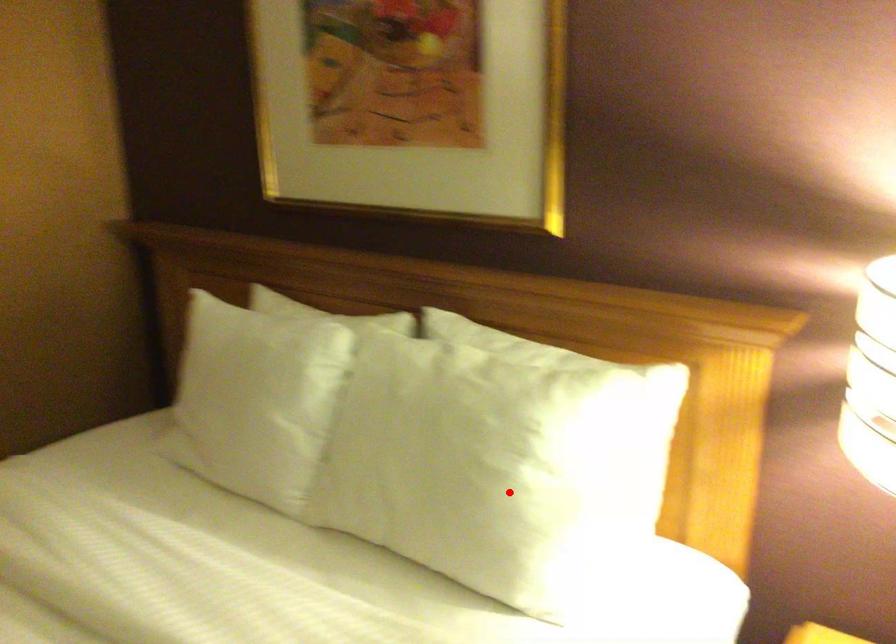
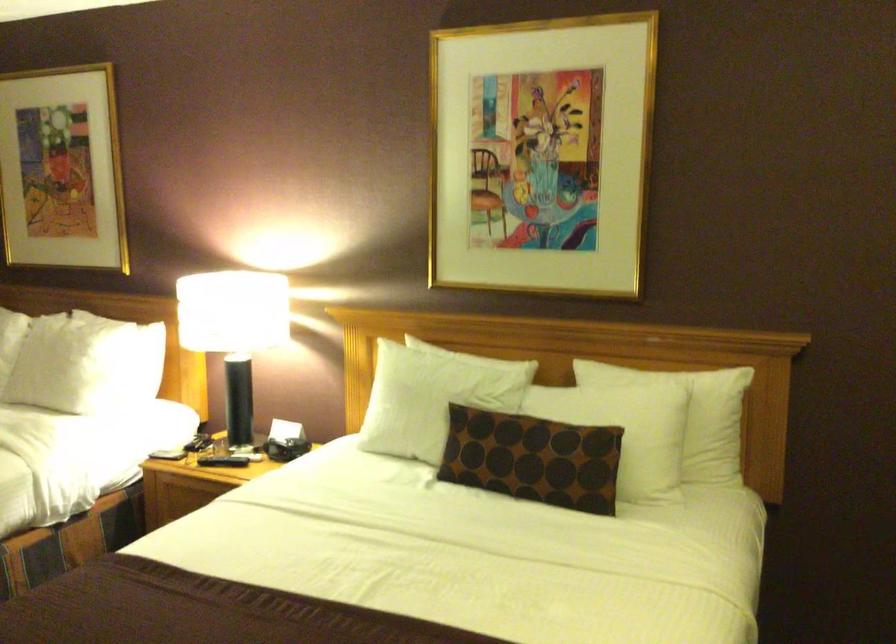
Locate, in the second image, the point that corresponds to the highlighted location in the first image.

(73, 364)